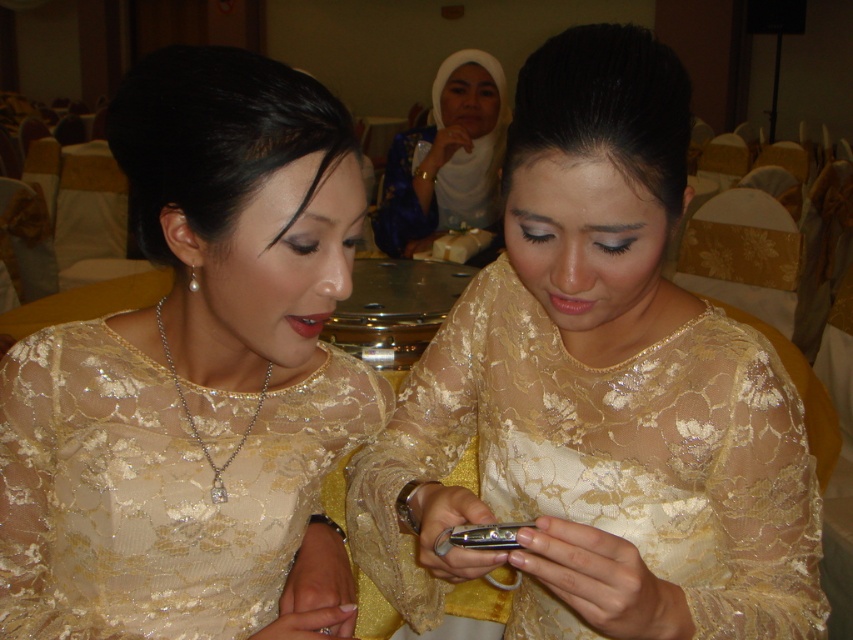
You are attending a formal event and notice two items in the image. One is the lace fabric phone at center and the other is the white lace hijab at upper center. From your perspective, which item is closer to you?

The lace fabric phone at center is closer to you because it is positioned in front of the white lace hijab at upper center.